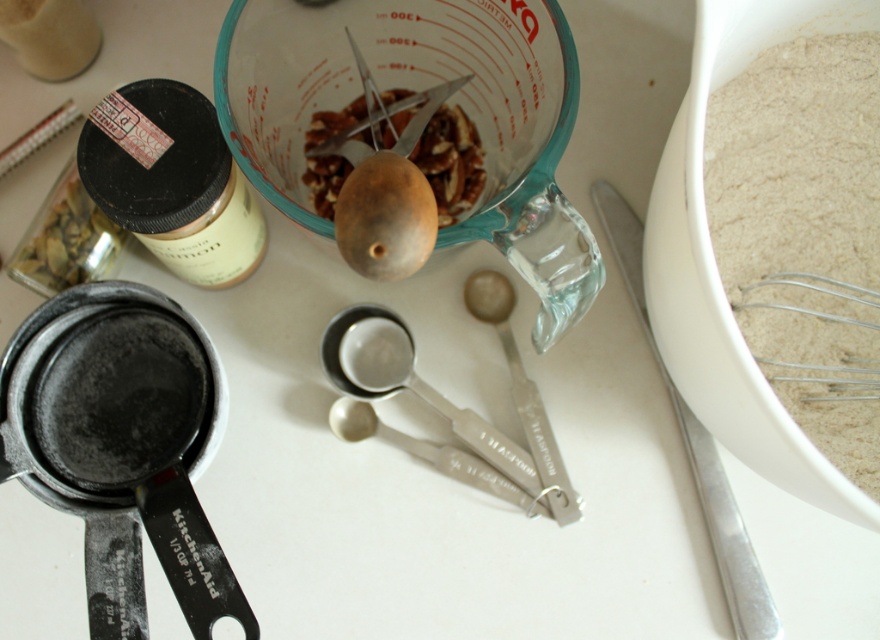
What do you see at coordinates (440, 145) in the screenshot?
I see `brown matte nuts at center` at bounding box center [440, 145].

Consider the image. Can you confirm if brown matte nuts at center is positioned to the right of wooden spoon at center?

Correct, you'll find brown matte nuts at center to the right of wooden spoon at center.

Which is behind, point (475, 164) or point (354, 48)?

The point (475, 164) is behind.

Find the location of a particular element. This screenshot has width=880, height=640. brown matte nuts at center is located at coordinates (440, 145).

Which is above, white powdery flour at right or brown matte nuts at center?

brown matte nuts at center

Does white powdery flour at right appear on the right side of brown matte nuts at center?

Correct, you'll find white powdery flour at right to the right of brown matte nuts at center.

The image size is (880, 640). Describe the element at coordinates (805, 234) in the screenshot. I see `white powdery flour at right` at that location.

The width and height of the screenshot is (880, 640). I want to click on white powdery flour at right, so click(x=805, y=234).

Who is lower down, brown matte nuts at center or silver metallic measuring spoon at center?

silver metallic measuring spoon at center

Who is positioned more to the right, brown matte nuts at center or silver metallic measuring spoon at center?

Positioned to the right is silver metallic measuring spoon at center.

Who is more forward, [408,108] or [362,364]?

Point [408,108] is in front.

Locate an element on the screen. brown matte nuts at center is located at coordinates (440, 145).